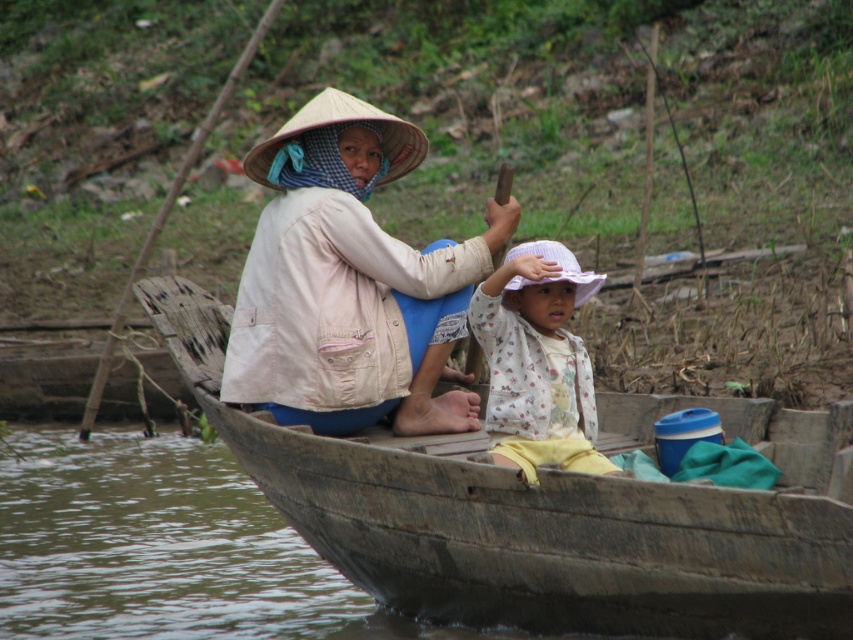
Question: Which point appears closest to the camera in this image?

Choices:
 (A) (496, 378)
 (B) (294, 419)

Answer: (A)

Question: Among these objects, which one is nearest to the camera?

Choices:
 (A) beige cotton jacket at center
 (B) white floral shirt at center
 (C) wooden boat at center

Answer: (B)

Question: Is beige cotton jacket at center below white floral shirt at center?

Choices:
 (A) yes
 (B) no

Answer: (B)

Question: Can you confirm if wooden boat at center is wider than beige cotton jacket at center?

Choices:
 (A) no
 (B) yes

Answer: (B)

Question: Which point appears closest to the camera in this image?

Choices:
 (A) (616, 612)
 (B) (538, 419)
 (C) (424, 300)

Answer: (A)

Question: Does beige cotton jacket at center have a smaller size compared to white floral shirt at center?

Choices:
 (A) yes
 (B) no

Answer: (A)